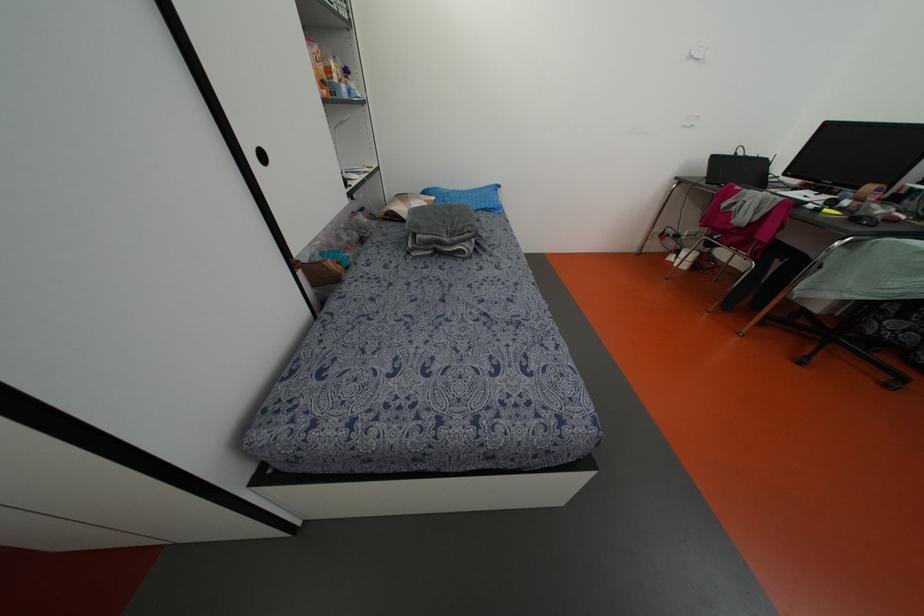
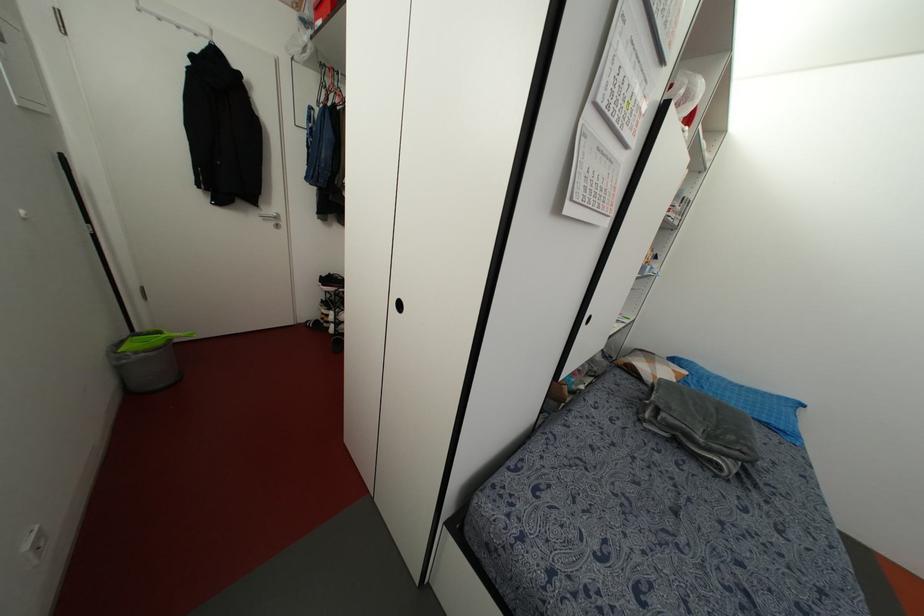
In the second image, find the point that corresponds to the point at 418,236 in the first image.

(663, 415)